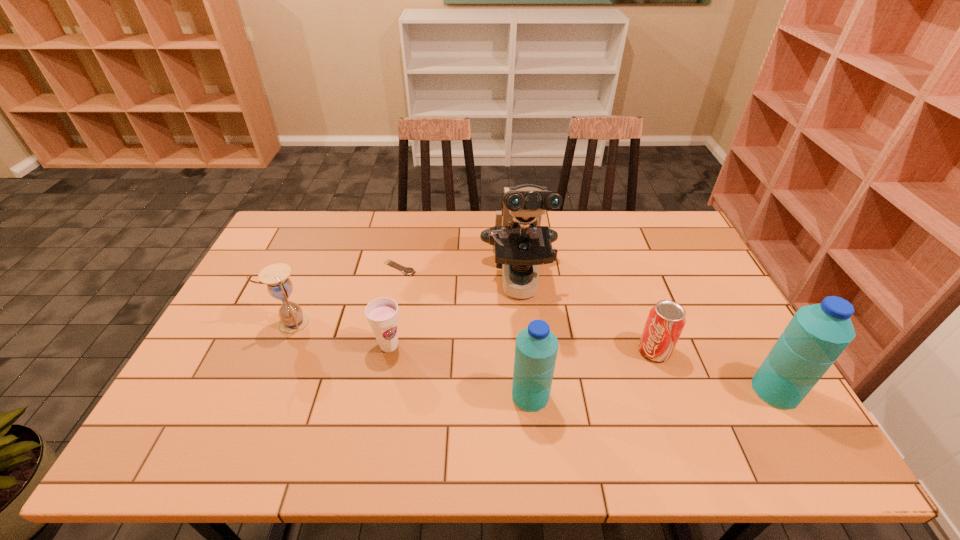
At what (x,y) coordinates should I click in order to perform the action: click on the left water bottle. Please return your answer as a coordinate pair (x, y). This screenshot has height=540, width=960. Looking at the image, I should click on (536, 348).

Where is `the rightmost object`? the rightmost object is located at coordinates (817, 334).

At what (x,y) coordinates should I click in order to perform the action: click on the right water bottle. Please return your answer as a coordinate pair (x, y). The image size is (960, 540). Looking at the image, I should click on (817, 334).

At what (x,y) coordinates should I click in order to perform the action: click on the shortest object. Please return your answer as a coordinate pair (x, y). The image size is (960, 540). Looking at the image, I should click on (410, 271).

Locate an element on the screen. Image resolution: width=960 pixels, height=540 pixels. cup is located at coordinates (382, 314).

Find the location of a particular element. hourglass is located at coordinates (293, 320).

I want to click on the leftmost object, so click(x=293, y=320).

At what (x,y) coordinates should I click in order to perform the action: click on the sixth object from left to right. Please return your answer as a coordinate pair (x, y). The image size is (960, 540). Looking at the image, I should click on (666, 320).

At what (x,y) coordinates should I click in order to perform the action: click on microscope. Please return your answer as a coordinate pair (x, y). This screenshot has width=960, height=540. Looking at the image, I should click on (520, 242).

In order to click on free space located 0.180m on the right of the left water bottle in this screenshot , I will do `click(622, 396)`.